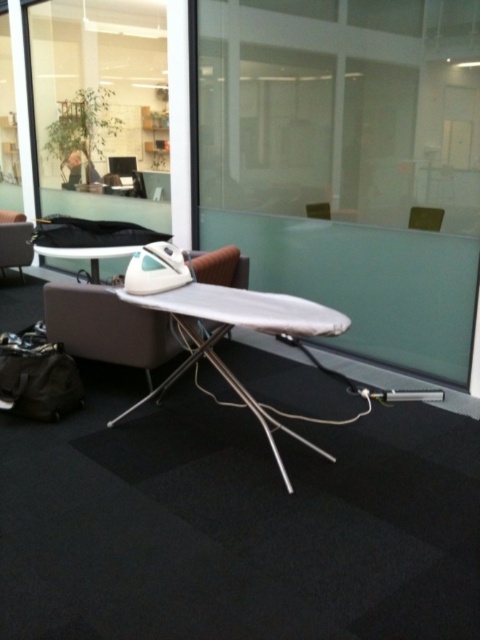
Based on the photo, is white glossy ironing board at center below white plastic ironing board at center?

Indeed, white glossy ironing board at center is positioned under white plastic ironing board at center.

Does white glossy ironing board at center have a smaller size compared to white plastic ironing board at center?

Incorrect, white glossy ironing board at center is not smaller in size than white plastic ironing board at center.

What do you see at coordinates (240, 326) in the screenshot?
I see `white glossy ironing board at center` at bounding box center [240, 326].

What are the coordinates of `white glossy ironing board at center` in the screenshot? It's located at (240, 326).

Is point (440, 212) more distant than point (308, 204)?

No, it is in front of (308, 204).

Is matte plastic chair at center above brown leather chair at center?

Incorrect, matte plastic chair at center is not positioned above brown leather chair at center.

Is point (420, 225) positioned before point (328, 216)?

Yes, it is.

You are a GUI agent. You are given a task and a screenshot of the screen. Output one action in this format:
    pyautogui.click(x=<x>, y=<y>)
    Task: Click on the matte plastic chair at center
    The width and height of the screenshot is (480, 640).
    Given the screenshot: What is the action you would take?
    pyautogui.click(x=425, y=218)

Does point (87, 237) come in front of point (316, 204)?

Yes.

Between white plastic ironing board at center and brown leather chair at center, which one has more height?

With more height is white plastic ironing board at center.

Does point (44, 221) come closer to viewer compared to point (319, 202)?

No, it is behind (319, 202).

What are the coordinates of `white plastic ironing board at center` in the screenshot? It's located at (91, 241).